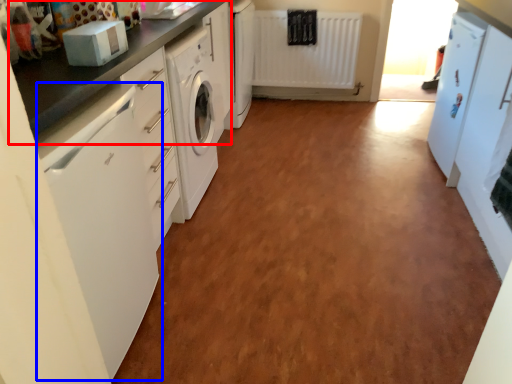
Question: Which of the following is the farthest to the observer, countertop (highlighted by a red box) or home appliance (highlighted by a blue box)?

Choices:
 (A) countertop
 (B) home appliance

Answer: (A)